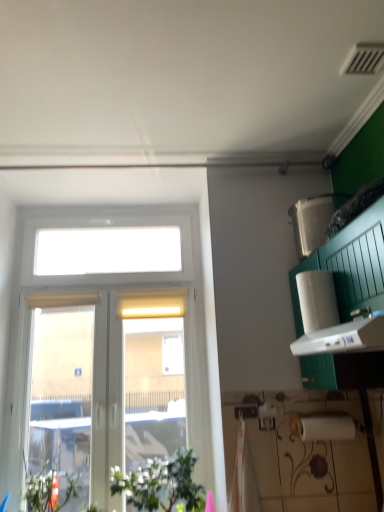
You are a GUI agent. You are given a task and a screenshot of the screen. Output one action in this format:
    pyautogui.click(x=<x>, y=<y>)
    Task: Click on the white matte paper towel at right
    The height and width of the screenshot is (512, 384).
    Given the screenshot: What is the action you would take?
    pyautogui.click(x=317, y=300)

What do you see at coordinates (161, 484) in the screenshot? The height and width of the screenshot is (512, 384). I see `green leafy plant at lower left` at bounding box center [161, 484].

At what (x,y) coordinates should I click in order to perform the action: click on white plastic window at left. Please return your answer as a coordinate pair (x, y). The height and width of the screenshot is (512, 384). Looking at the image, I should click on (120, 326).

Locate an element on the screen. This screenshot has height=512, width=384. white matte paper towel at right is located at coordinates (317, 300).

Which point is more distant from viewer, (155, 466) or (190, 312)?

The point (190, 312) is farther from the camera.

Would you say green leafy plant at lower left is inside or outside white plastic window at left?

green leafy plant at lower left is spatially situated outside white plastic window at left.

From the image's perspective, is green leafy plant at lower left above or below white plastic window at left?

green leafy plant at lower left is below white plastic window at left.

Which of these two, green leafy plant at lower left or white plastic window at left, is bigger?

white plastic window at left.

Between white plastic window at left and green leafy plant at lower left, which one is positioned behind?

white plastic window at left is further away from the camera.

From the picture: Is white plastic window at left bigger or smaller than green leafy plant at lower left?

In the image, white plastic window at left appears to be larger than green leafy plant at lower left.

From their relative heights in the image, would you say white plastic window at left is taller or shorter than green leafy plant at lower left?

white plastic window at left is taller than green leafy plant at lower left.

Which is in front, point (300, 283) or point (204, 468)?

Positioned in front is point (300, 283).

Is white matte paper towel at right to the left of white plastic window at left from the viewer's perspective?

No, white matte paper towel at right is not to the left of white plastic window at left.

Is white matte paper towel at right bigger or smaller than white plastic window at left?

In the image, white matte paper towel at right appears to be smaller than white plastic window at left.

Which of these two, white matte paper towel at right or green leafy plant at lower left, is bigger?

green leafy plant at lower left is bigger.

Is white matte paper towel at right facing towards green leafy plant at lower left?

No.

Is white matte paper towel at right closer to camera compared to green leafy plant at lower left?

That is True.

From the image's perspective, is white matte paper towel at right located above or below green leafy plant at lower left?

From the image's perspective, white matte paper towel at right appears above green leafy plant at lower left.

Between white plastic window at left and white matte paper towel at right, which one has smaller size?

Smaller between the two is white matte paper towel at right.

Is white plastic window at left to the right of white matte paper towel at right from the viewer's perspective?

No, white plastic window at left is not to the right of white matte paper towel at right.

Does point (31, 302) appear closer or farther from the camera than point (322, 317)?

Point (31, 302).

Would you consider green leafy plant at lower left to be distant from white matte paper towel at right?

Indeed, green leafy plant at lower left is not near white matte paper towel at right.

Measure the distance between green leafy plant at lower left and white matte paper towel at right.

3.50 feet.

Is point (162, 482) positioned before point (330, 324)?

That is False.

Would you say green leafy plant at lower left is to the left or to the right of white matte paper towel at right in the picture?

From the image, it's evident that green leafy plant at lower left is to the left of white matte paper towel at right.

I want to click on plant below the white plastic window at left (from the image's perspective), so click(x=161, y=484).

This screenshot has width=384, height=512. I want to click on window above the green leafy plant at lower left (from the image's perspective), so click(120, 326).

Which object lies nearer to the anchor point green leafy plant at lower left, white plastic window at left or white matte paper towel at right?

The object closer to green leafy plant at lower left is white plastic window at left.

Looking at the image, which one is located further to white plastic window at left, white matte paper towel at right or green leafy plant at lower left?

white matte paper towel at right lies further to white plastic window at left than the other object.

Based on their spatial positions, is green leafy plant at lower left or white matte paper towel at right further from white plastic window at left?

white matte paper towel at right is positioned further to the anchor white plastic window at left.

Looking at the image, which one is located further to green leafy plant at lower left, white matte paper towel at right or white plastic window at left?

Based on the image, white matte paper towel at right appears to be further to green leafy plant at lower left.

Consider the image. Based on their spatial positions, is green leafy plant at lower left or white plastic window at left further from white matte paper towel at right?

white plastic window at left lies further to white matte paper towel at right than the other object.

Based on the photo, which object lies further to the anchor point white matte paper towel at right, white plastic window at left or green leafy plant at lower left?

white plastic window at left is further to white matte paper towel at right.

In order to click on plant between white plastic window at left and white matte paper towel at right in the horizontal direction in this screenshot , I will do `click(161, 484)`.